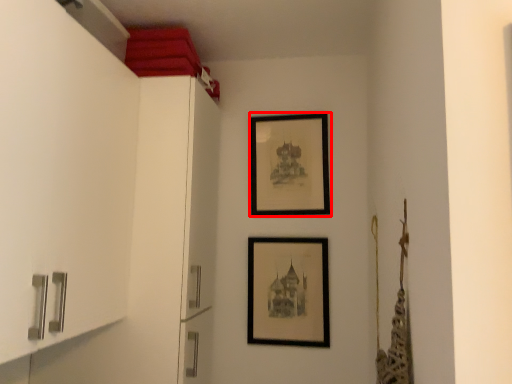
Question: From the image's perspective, what is the correct spatial relationship of picture frame (annotated by the red box) in relation to picture frame?

Choices:
 (A) below
 (B) above

Answer: (B)